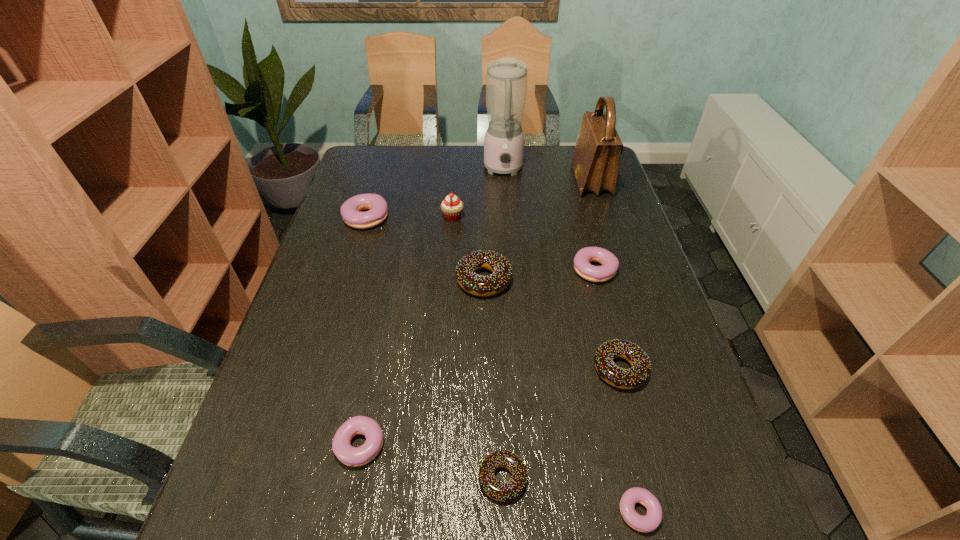
Where is `food processor`? This screenshot has height=540, width=960. food processor is located at coordinates (506, 81).

Find the location of `shoulder bag`. shoulder bag is located at coordinates (595, 162).

This screenshot has width=960, height=540. What are the coordinates of `the eighth shortest object` in the screenshot? It's located at (452, 207).

The height and width of the screenshot is (540, 960). Identify the location of cupcake. (452, 207).

This screenshot has height=540, width=960. In order to click on the leftmost purple doughnut in this screenshot , I will do `click(351, 209)`.

Locate an element on the screen. the leftmost object is located at coordinates (351, 209).

Image resolution: width=960 pixels, height=540 pixels. Find the location of `the biggest chocolate doughnut`. the biggest chocolate doughnut is located at coordinates (475, 284).

Find the location of a particular element. The height and width of the screenshot is (540, 960). the third nearest purple doughnut is located at coordinates (610, 263).

Locate an element on the screen. the second nearest chocolate doughnut is located at coordinates (638, 374).

Where is `the rightmost chocolate doughnut`? This screenshot has height=540, width=960. the rightmost chocolate doughnut is located at coordinates (638, 374).